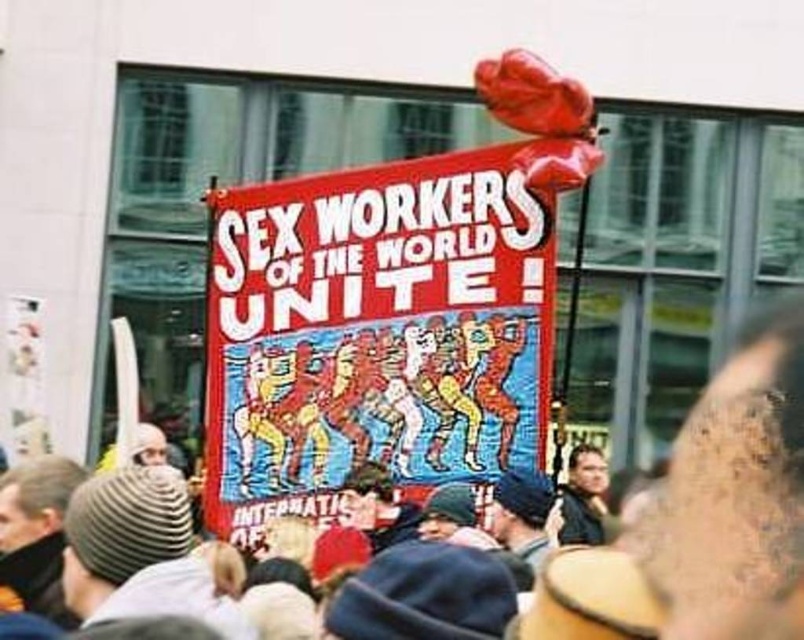
You are a photographer standing at the edge of the protest crowd. You want to take a photo that includes both the dark blue knit cap at center and the dark brown leather jacket at lower right. The camera you are using has a maximum focus range of 6 meters. Can you capture both objects in focus without moving your position?

The dark blue knit cap at center is 6.88 meters away from the dark brown leather jacket at lower right. Since the maximum focus range of the camera is 6 meters, the distance between them exceeds this limit. Therefore, you cannot capture both objects in focus without moving your position.

You are a photographer trying to capture a clear shot of the dark blue knit cap at center and the dark brown leather jacket at lower right. Based on their heights, which object should you focus on first to ensure both are in frame?

The dark blue knit cap at center has a lesser height compared to dark brown leather jacket at lower right, so you should focus on the dark brown leather jacket at lower right first to ensure both are in frame.

You are a photographer trying to capture the protest scene. You notice a point at coordinates (378, 328) in the image. According to the scene description, what object is this point located on?

The point at coordinates (378, 328) is located on the red fabric banner at center.